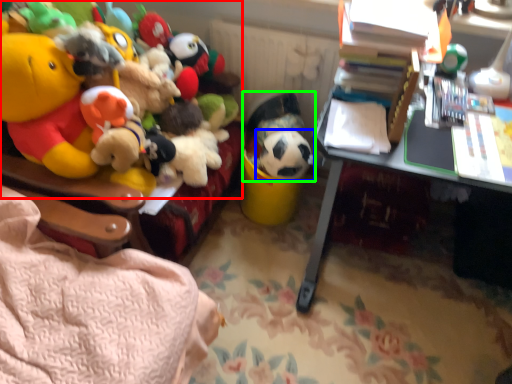
Question: Estimate the real-world distances between objects in this image. Which object is closer to toy (highlighted by a red box), toy (highlighted by a blue box) or toy (highlighted by a green box)?

Choices:
 (A) toy
 (B) toy

Answer: (B)